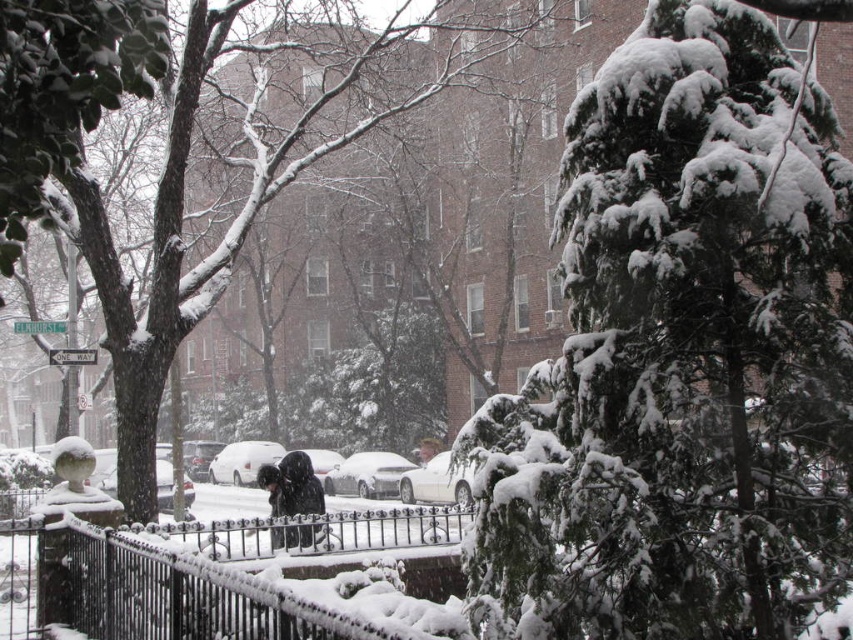
Question: Can you confirm if snow-covered evergreen at center is thinner than snow-covered evergreen tree at right?

Choices:
 (A) no
 (B) yes

Answer: (B)

Question: Based on their relative distances, which object is farther from the snow-covered wrought iron fence at center?

Choices:
 (A) black wrought iron fence at center
 (B) dark wool coat at center

Answer: (B)

Question: From the image, what is the correct spatial relationship of snow-covered evergreen tree at right in relation to dark wool coat at center?

Choices:
 (A) left
 (B) right

Answer: (A)

Question: Does snow-covered evergreen at center have a larger size compared to dark wool coat at center?

Choices:
 (A) yes
 (B) no

Answer: (A)

Question: Estimate the real-world distances between objects in this image. Which object is closer to the snow-covered evergreen at center?

Choices:
 (A) dark wool coat at center
 (B) black wrought iron fence at center
 (C) snow-covered evergreen tree at right

Answer: (C)

Question: Which point is farther to the camera?

Choices:
 (A) black wrought iron fence at center
 (B) snow-covered evergreen at center
 (C) snow-covered wrought iron fence at center
 (D) snow-covered evergreen tree at right

Answer: (A)